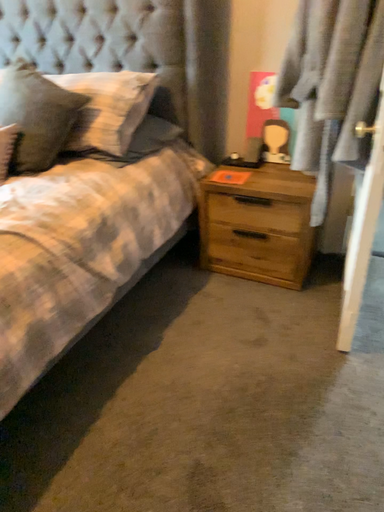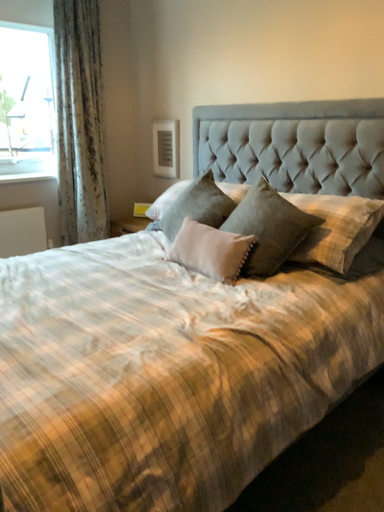
Question: How did the camera likely rotate when shooting the video?

Choices:
 (A) rotated downward
 (B) rotated upward

Answer: (B)